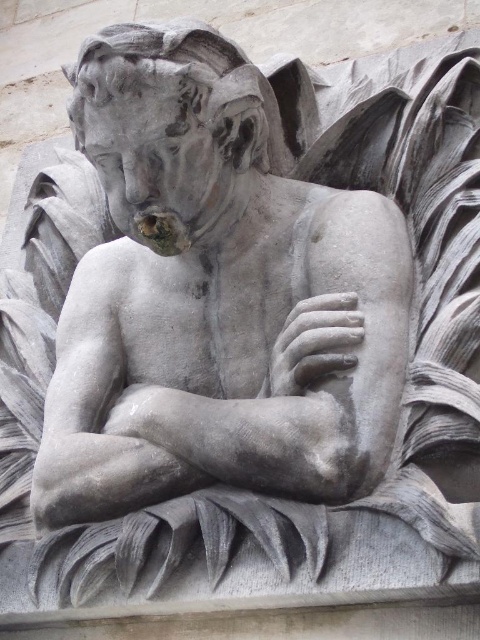
You are an art conservator standing at the center of the room. The gray stone statue at center is positioned at coordinates 0.467 on the x and 0.450 on the y axis. If you need to move a protective barrier around it without moving the statue, which direction should you move to ensure the barrier is placed correctly?

The gray stone statue at center is located at point [216,298]. To place the protective barrier around it without moving the statue, you should move in all directions around the statue to encircle it properly.

You are an art conservator examining the gray stone statue at center and the gray stone hand at center. According to the spatial arrangement, which object is positioned to the right?

The gray stone hand at center is positioned to the right of the gray stone statue at center.